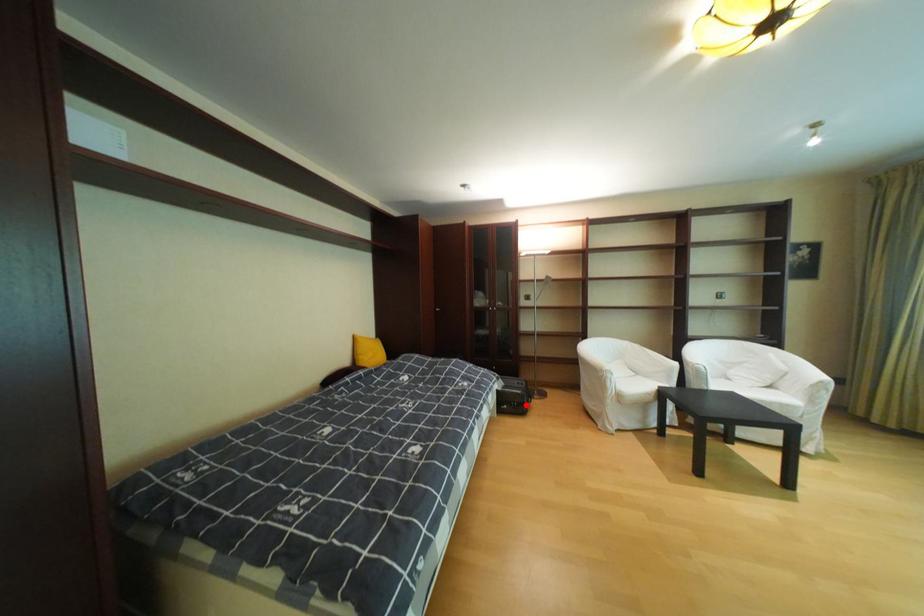
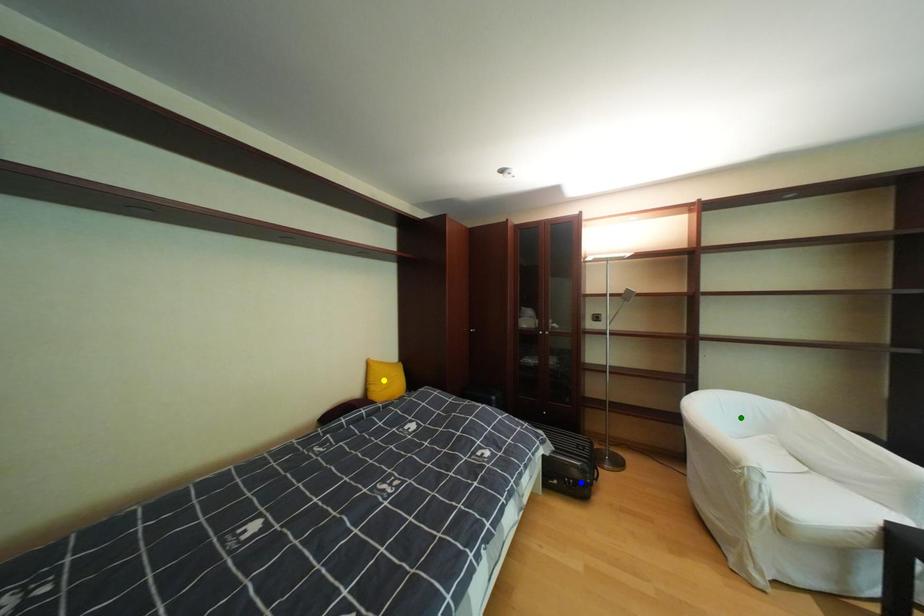
Question: I am providing you with two images of the same scene from different viewpoints. A red point is marked on the first image. You are given multiple points on the second image. Which mark in image 2 goes with the point in image 1?

Choices:
 (A) blue point
 (B) green point
 (C) yellow point

Answer: (A)